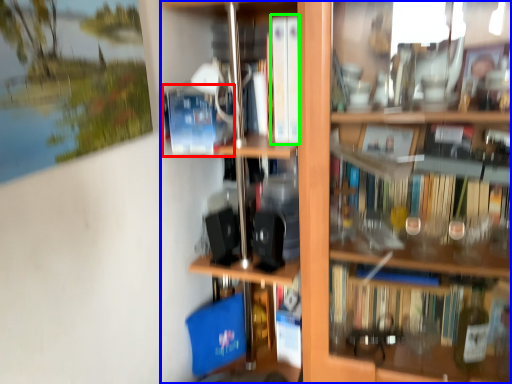
Question: Based on their relative distances, which object is farther from paperback book (highlighted by a red box)? Choose from shelf (highlighted by a blue box) and book (highlighted by a green box).

Choices:
 (A) shelf
 (B) book

Answer: (A)